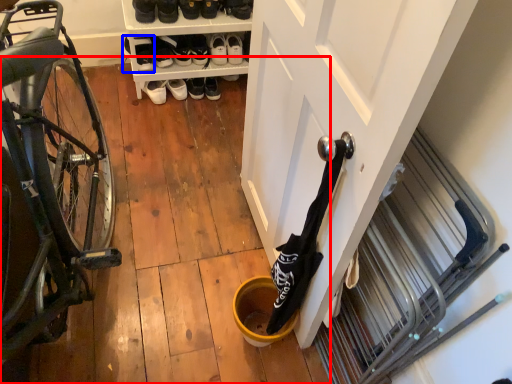
Question: Which of the following is the closest to the observer, wood (highlighted by a red box) or footwear (highlighted by a blue box)?

Choices:
 (A) wood
 (B) footwear

Answer: (A)